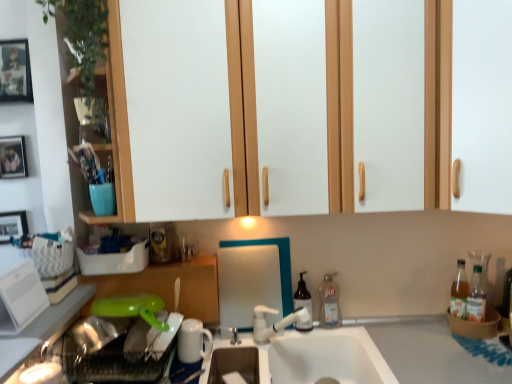
Image resolution: width=512 pixels, height=384 pixels. I want to click on metallic silver picture frame at upper left, marked as the first picture frame in a top-to-bottom arrangement, so click(x=15, y=71).

What do you see at coordinates (15, 71) in the screenshot? This screenshot has height=384, width=512. I see `metallic silver picture frame at upper left, the 1th picture frame from the front` at bounding box center [15, 71].

Measure the distance between point (x=300, y=300) and camera.

Point (x=300, y=300) is 1.68 meters from camera.

You are a GUI agent. You are given a task and a screenshot of the screen. Output one action in this format:
    pyautogui.click(x=<x>, y=<y>)
    Task: Click on the metallic silver picture frame at upper left, the 1th picture frame from the front
    This screenshot has height=384, width=512.
    Given the screenshot: What is the action you would take?
    pyautogui.click(x=15, y=71)

Which of these two, metallic photo frame at upper left, which is counted as the 2th picture frame, starting from the front, or white ceramic sink at center, is bigger?

white ceramic sink at center.

Is point (24, 146) positioned after point (367, 356)?

That is True.

From the image's perspective, is metallic photo frame at upper left, positioned as the second picture frame in top-to-bottom order, positioned above or below white ceramic sink at center?

metallic photo frame at upper left, positioned as the second picture frame in top-to-bottom order, is above white ceramic sink at center.

This screenshot has height=384, width=512. Identify the location of sink directly beneath the metallic photo frame at upper left, positioned as the second picture frame in top-to-bottom order (from a real-world perspective). (315, 357).

Is white glossy refrigerator at left, the 2th appliance from the bottom, next to white glossy cabinet at upper center and touching it?

There is a gap between white glossy refrigerator at left, the 2th appliance from the bottom, and white glossy cabinet at upper center.

Does white glossy refrigerator at left, the second appliance from the back, appear on the left side of white glossy cabinet at upper center?

Correct, you'll find white glossy refrigerator at left, the second appliance from the back, to the left of white glossy cabinet at upper center.

Considering the relative sizes of white glossy refrigerator at left, the second appliance from the back, and white glossy cabinet at upper center in the image provided, is white glossy refrigerator at left, the second appliance from the back, shorter than white glossy cabinet at upper center?

Yes, white glossy refrigerator at left, the second appliance from the back, is shorter than white glossy cabinet at upper center.

Looking at the image, does white glossy refrigerator at left, arranged as the 1th appliance when viewed from the left, seem bigger or smaller compared to white glossy cabinet at upper center?

white glossy refrigerator at left, arranged as the 1th appliance when viewed from the left, is smaller than white glossy cabinet at upper center.

Is wooden framed picture at left, the 3th picture frame in the top-to-bottom sequence, thinner than translucent plastic soap dispenser at center, placed as the 1th bottle when sorted from left to right?

Yes, wooden framed picture at left, the 3th picture frame in the top-to-bottom sequence, is thinner than translucent plastic soap dispenser at center, placed as the 1th bottle when sorted from left to right.

In order to click on the 1st picture frame above the translucent plastic soap dispenser at center, placed as the 1th bottle when sorted from left to right (from the image's perspective) in this screenshot , I will do `click(13, 225)`.

Is wooden framed picture at left, the 3th picture frame in the top-to-bottom sequence, far from translucent plastic soap dispenser at center, which is counted as the second bottle, starting from the right?

Indeed, wooden framed picture at left, the 3th picture frame in the top-to-bottom sequence, is not near translucent plastic soap dispenser at center, which is counted as the second bottle, starting from the right.

Is white glossy refrigerator at left, arranged as the 1th appliance when viewed from the left, positioned with its back to white plastic tap at center?

No, white glossy refrigerator at left, arranged as the 1th appliance when viewed from the left,'s orientation is not away from white plastic tap at center.

In the scene shown: Considering the relative sizes of white glossy refrigerator at left, the 2th appliance from the bottom, and white plastic tap at center in the image provided, is white glossy refrigerator at left, the 2th appliance from the bottom, thinner than white plastic tap at center?

Yes.

From the image's perspective, does white glossy refrigerator at left, the 2th appliance from the bottom, appear higher than white plastic tap at center?

Yes.

What's the angular difference between white glossy refrigerator at left, arranged as the first appliance when viewed from the top, and white plastic tap at center's facing directions?

36.7 degrees separate the facing orientations of white glossy refrigerator at left, arranged as the first appliance when viewed from the top, and white plastic tap at center.

Is the depth of green plastic dish washer at lower left less than that of green plastic lid at lower left, arranged as the 2th cabinetry when viewed from the top?

Yes.

Considering the sizes of green plastic dish washer at lower left and green plastic lid at lower left, positioned as the first cabinetry in left-to-right order, in the image, is green plastic dish washer at lower left taller or shorter than green plastic lid at lower left, positioned as the first cabinetry in left-to-right order,?

Considering their sizes, green plastic dish washer at lower left has less height than green plastic lid at lower left, positioned as the first cabinetry in left-to-right order.

How different are the orientations of green plastic dish washer at lower left and green plastic lid at lower left, arranged as the 2th cabinetry when viewed from the top, in degrees?

There is a 6.18-degree angle between the facing directions of green plastic dish washer at lower left and green plastic lid at lower left, arranged as the 2th cabinetry when viewed from the top.

Which point is more forward, (84, 341) or (166, 265)?

The point (84, 341) is in front.

Can you confirm if white plastic tap at center is smaller than white ceramic mug at lower center, acting as the 1th appliance starting from the back?

Incorrect, white plastic tap at center is not smaller in size than white ceramic mug at lower center, acting as the 1th appliance starting from the back.

How much distance is there between white plastic tap at center and white ceramic mug at lower center, the second appliance from the left?

white plastic tap at center is 23.67 centimeters from white ceramic mug at lower center, the second appliance from the left.

Identify the location of appliance located below the white plastic tap at center (from the image's perspective). The image size is (512, 384). (193, 341).

Can you tell me how much white plastic tap at center and white ceramic mug at lower center, marked as the second appliance in a front-to-back arrangement, differ in facing direction?

The angular difference between white plastic tap at center and white ceramic mug at lower center, marked as the second appliance in a front-to-back arrangement, is 54.5 degrees.

From a real-world perspective, is translucent plastic soap dispenser at center, placed as the 1th bottle when sorted from left to right, on top of green plastic lid at lower left, arranged as the 2th cabinetry when viewed from the top?

No, from a real-world perspective, translucent plastic soap dispenser at center, placed as the 1th bottle when sorted from left to right, is not on top of green plastic lid at lower left, arranged as the 2th cabinetry when viewed from the top.

Would you consider translucent plastic soap dispenser at center, which is counted as the second bottle, starting from the right, to be distant from green plastic lid at lower left, placed as the 2th cabinetry when sorted from right to left?

translucent plastic soap dispenser at center, which is counted as the second bottle, starting from the right, is near green plastic lid at lower left, placed as the 2th cabinetry when sorted from right to left, not far away.

In terms of height, does translucent plastic soap dispenser at center, placed as the 1th bottle when sorted from left to right, look taller or shorter compared to green plastic lid at lower left, arranged as the 2th cabinetry when viewed from the top?

translucent plastic soap dispenser at center, placed as the 1th bottle when sorted from left to right, is shorter than green plastic lid at lower left, arranged as the 2th cabinetry when viewed from the top.

Can you confirm if translucent plastic soap dispenser at center, placed as the 1th bottle when sorted from left to right, is positioned to the left of green plastic lid at lower left, placed as the first cabinetry when sorted from bottom to top?

No.

From the white ceramic sink at center, count the 1st picture frame to the left and point to it. Please provide its 2D coordinates.

[(13, 157)]

Where is `appliance in front of the white glossy cabinet at upper center`? This screenshot has width=512, height=384. appliance in front of the white glossy cabinet at upper center is located at coordinates (20, 298).

Based on their spatial positions, is wooden framed picture at left, the 1th picture frame when ordered from back to front, or white glossy cabinet at upper center further from white glossy refrigerator at left, positioned as the first appliance in front-to-back order?

white glossy cabinet at upper center is further to white glossy refrigerator at left, positioned as the first appliance in front-to-back order.

From the image, which object appears to be nearer to white ceramic mug at lower center, the first appliance ordered from the bottom, white matte cabinet door at upper right, arranged as the second cabinetry when viewed from the left, or white glossy cabinet at upper center?

Among the two, white glossy cabinet at upper center is located nearer to white ceramic mug at lower center, the first appliance ordered from the bottom.

From the image, which object appears to be nearer to clear plastic bottle at sink right, the 2th bottle in the left-to-right sequence, white glossy cabinet at upper center or wooden framed picture at left, placed as the 3th picture frame when sorted from front to back?

white glossy cabinet at upper center lies closer to clear plastic bottle at sink right, the 2th bottle in the left-to-right sequence, than the other object.

Considering their positions, is metallic photo frame at upper left, positioned as the second picture frame in top-to-bottom order, positioned closer to white plastic tap at center than white ceramic sink at center?

Among the two, white ceramic sink at center is located nearer to white plastic tap at center.

Considering their positions, is white ceramic mug at lower center, positioned as the second appliance in top-to-bottom order, positioned further to white glossy refrigerator at left, arranged as the first appliance when viewed from the top, than metallic photo frame at upper left, the 2th picture frame when ordered from back to front?

metallic photo frame at upper left, the 2th picture frame when ordered from back to front, lies further to white glossy refrigerator at left, arranged as the first appliance when viewed from the top, than the other object.

When comparing their distances from white ceramic mug at lower center, acting as the 1th appliance starting from the back, does white glossy refrigerator at left, arranged as the first appliance when viewed from the top, or wooden framed picture at left, the 1th picture frame when ordered from back to front, seem further?

Among the two, wooden framed picture at left, the 1th picture frame when ordered from back to front, is located further to white ceramic mug at lower center, acting as the 1th appliance starting from the back.

From the image, which object appears to be farther from white glossy refrigerator at left, acting as the 2th appliance starting from the right, translucent plastic soap dispenser at center, placed as the 1th bottle when sorted from left to right, or clear plastic bottle at sink right, the 2th bottle in the left-to-right sequence?

clear plastic bottle at sink right, the 2th bottle in the left-to-right sequence, lies further to white glossy refrigerator at left, acting as the 2th appliance starting from the right, than the other object.

Based on the photo, estimate the real-world distances between objects in this image. Which object is further from green plastic lid at lower left, arranged as the 2th cabinetry when viewed from the top, wooden framed picture at left, the 1th picture frame when ordered from bottom to top, or white matte cabinet door at upper right, which is the first cabinetry from right to left?

white matte cabinet door at upper right, which is the first cabinetry from right to left, is further to green plastic lid at lower left, arranged as the 2th cabinetry when viewed from the top.

This screenshot has width=512, height=384. What are the coordinates of `bottle between wooden framed picture at left, the 1th picture frame when ordered from bottom to top, and clear plastic bottle at sink right, placed as the 1th bottle when sorted from right to left, from left to right` in the screenshot? It's located at (303, 304).

This screenshot has width=512, height=384. Identify the location of cabinetry between wooden framed picture at left, placed as the 3th picture frame when sorted from front to back, and clear plastic bottle at sink right, placed as the 1th bottle when sorted from right to left, in the horizontal direction. (170, 286).

I want to click on sink situated between metallic silver picture frame at upper left, which is the 3th picture frame from bottom to top, and clear plastic bottle at sink right, placed as the 1th bottle when sorted from right to left, from left to right, so click(x=315, y=357).

At what (x,y) coordinates should I click in order to perform the action: click on cabinetry between green plastic dish washer at lower left and translucent plastic soap dispenser at center, which is counted as the second bottle, starting from the right, from left to right. Please return your answer as a coordinate pair (x, y). Looking at the image, I should click on (170, 286).